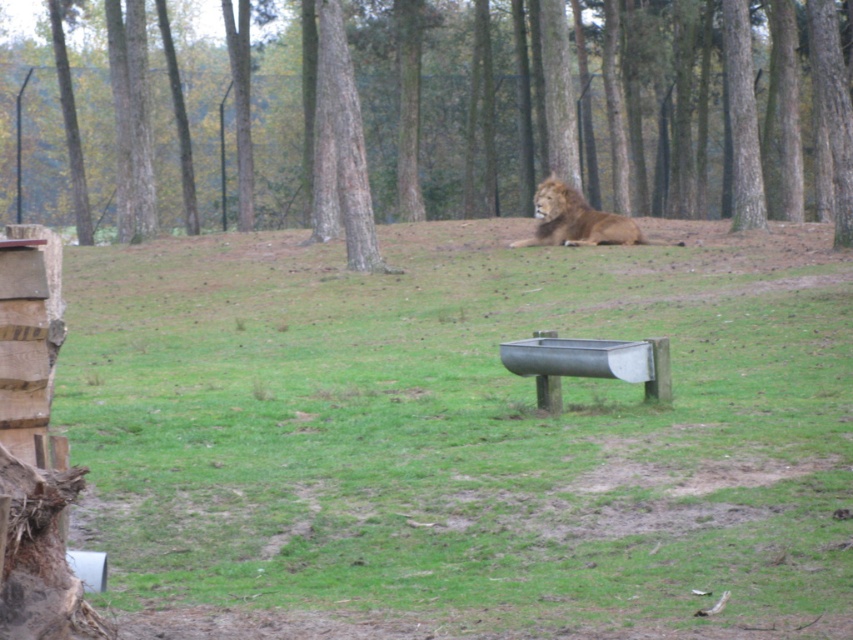
You are a gardener standing in the middle of the scene. You need to place a new decorative stone between the green grassy at center and the brown wood tree at center. Based on their positions, which object should the stone be closer to?

The green grassy at center is in front of the brown wood tree at center, so the stone should be placed closer to the brown wood tree at center to maintain the spatial relationship between them.

You are a photographer standing at the edge of the scene. You want to take a photo that includes both the green grassy at center and the golden fur lion at center. Which object should be closer to the camera to ensure both are in focus?

The green grassy at center is in front of the golden fur lion at center, so to ensure both are in focus, the photographer should position the camera so that the green grassy at center is closer to the camera. This way, the depth of field will cover both the foreground grass and the lion behind it.